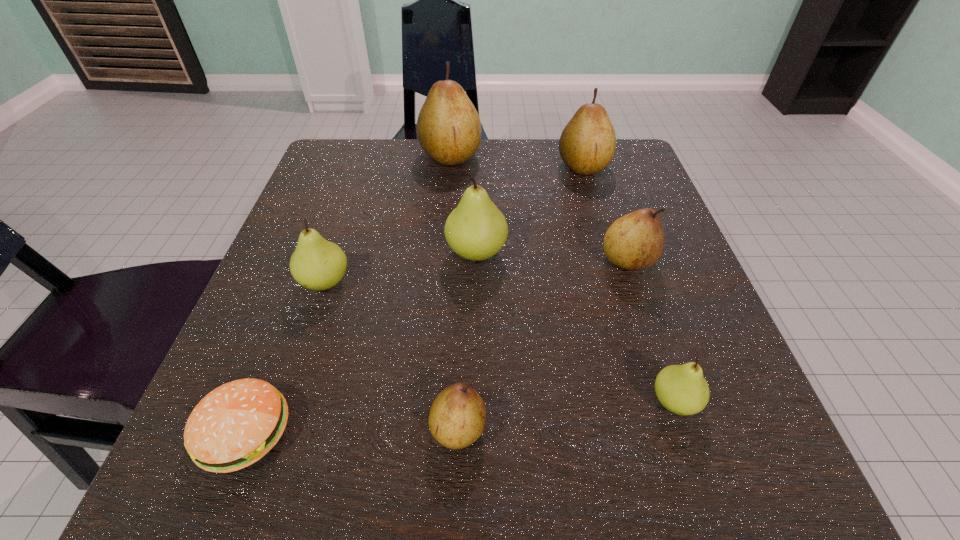
The width and height of the screenshot is (960, 540). In order to click on object that can be found as the fifth closest to the tallest object in this screenshot , I will do `click(235, 425)`.

The image size is (960, 540). I want to click on object that is the closest to the third smallest brown pear, so click(x=449, y=130).

Where is `pear that is the third closest to the shortest object`? The height and width of the screenshot is (540, 960). pear that is the third closest to the shortest object is located at coordinates (476, 230).

Point out which pear is positioned as the fourth nearest to the rightmost green pear. Please provide its 2D coordinates. Your answer should be formatted as a tuple, i.e. [(x, y)], where the tuple contains the x and y coordinates of a point satisfying the conditions above.

[(317, 264)]

Find the location of a particular element. The width and height of the screenshot is (960, 540). the closest brown pear to the nearest green pear is located at coordinates (635, 241).

This screenshot has height=540, width=960. Find the location of `brown pear that stands as the second closest to the smallest brown pear`. brown pear that stands as the second closest to the smallest brown pear is located at coordinates (587, 144).

Point out which green pear is positioned as the nearest to the brown patty. Please provide its 2D coordinates. Your answer should be formatted as a tuple, i.e. [(x, y)], where the tuple contains the x and y coordinates of a point satisfying the conditions above.

[(317, 264)]

Locate which green pear is the third closest to the third smallest brown pear. Please provide its 2D coordinates. Your answer should be formatted as a tuple, i.e. [(x, y)], where the tuple contains the x and y coordinates of a point satisfying the conditions above.

[(682, 389)]

You are a GUI agent. You are given a task and a screenshot of the screen. Output one action in this format:
    pyautogui.click(x=<x>, y=<y>)
    Task: Click on the free region that satisfies the following two spatial constraints: 1. on the front side of the nearest brown pear; 2. on the right side of the tallest pear
    This screenshot has width=960, height=540.
    Given the screenshot: What is the action you would take?
    pyautogui.click(x=426, y=428)

What are the coordinates of `free location that satisfies the following two spatial constraints: 1. on the back side of the nearest green pear; 2. on the left side of the nearest brown pear` in the screenshot? It's located at (459, 402).